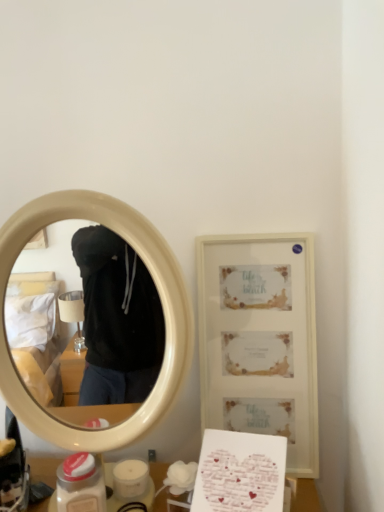
Image resolution: width=384 pixels, height=512 pixels. What do you see at coordinates (304, 495) in the screenshot? I see `matte white table at lower center` at bounding box center [304, 495].

This screenshot has height=512, width=384. In order to click on matte white table at lower center in this screenshot , I will do `click(304, 495)`.

The width and height of the screenshot is (384, 512). Find the location of `matte white table at lower center`. matte white table at lower center is located at coordinates (304, 495).